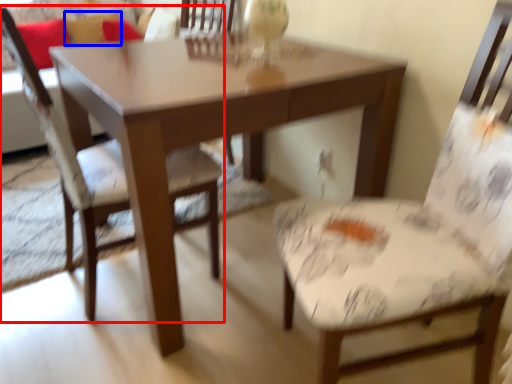
Question: Among these objects, which one is nearest to the camera, chair (highlighted by a red box) or pillow (highlighted by a blue box)?

Choices:
 (A) chair
 (B) pillow

Answer: (A)